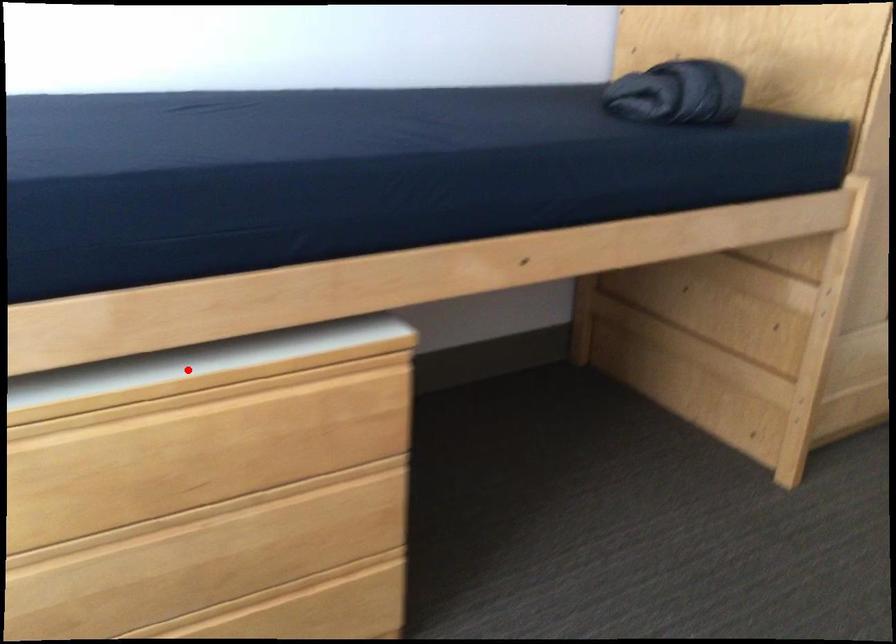
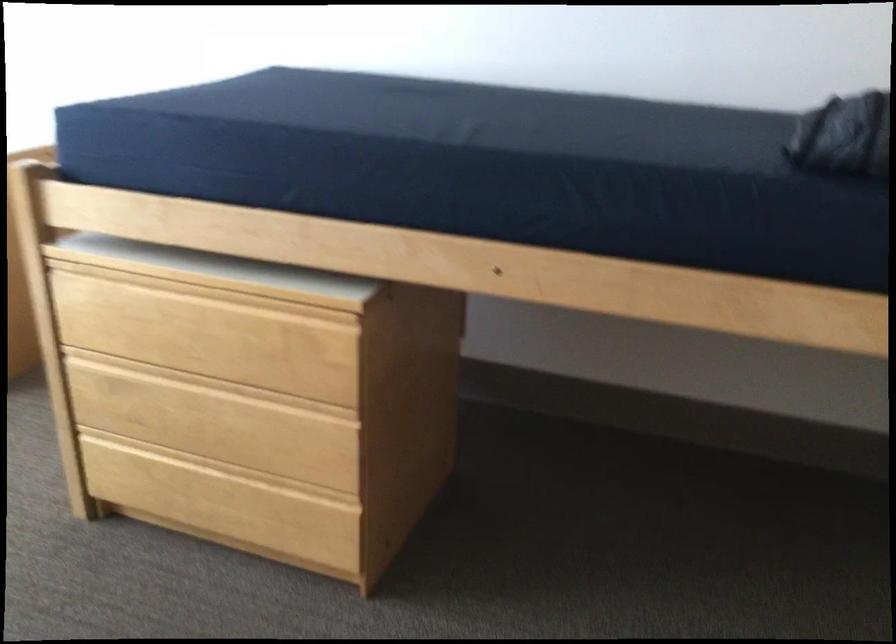
Question: I am providing you with two images of the same scene from different viewpoints. Image1 has a red point marked. In image2, the corresponding 3D location appears at what relative position? Reply with the corresponding letter.

Choices:
 (A) Closer
 (B) Farther

Answer: (B)